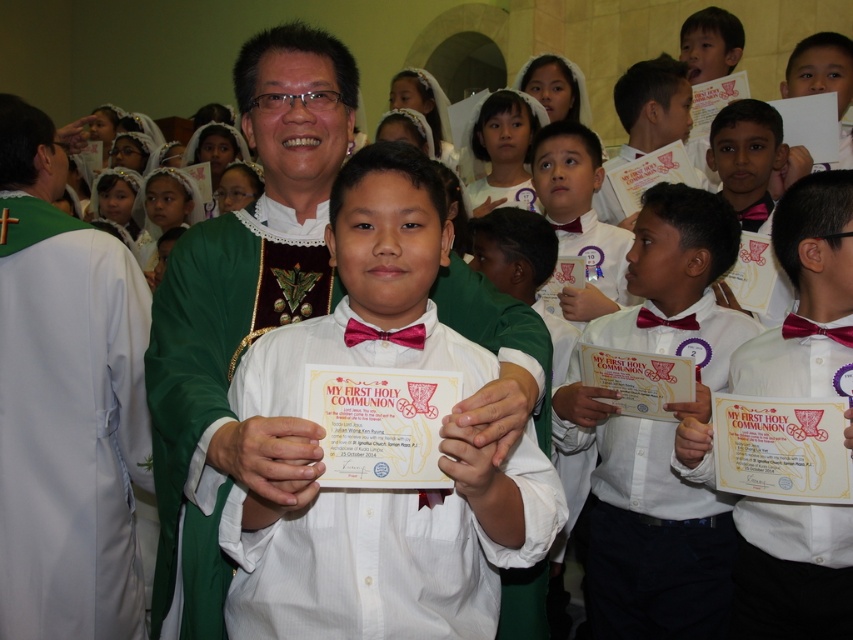
You are an event photographer positioned at the back of the church. You need to capture a closeup shot of the white glossy bow tie at center. According to the scene description, where should you aim your camera?

The white glossy bow tie at center is located at point (807, 296), so you should aim your camera at those coordinates to capture the closeup shot.